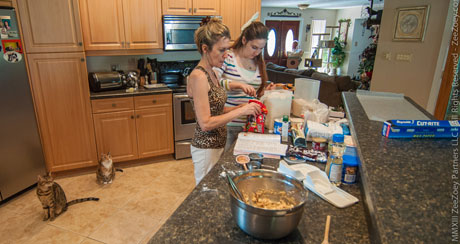
This screenshot has width=460, height=244. I want to click on door, so click(x=273, y=27), click(x=285, y=30).